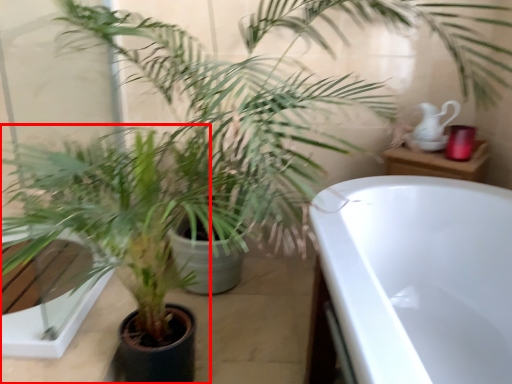
Question: From the image's perspective, where is houseplant (annotated by the red box) located in relation to tea pot in the image?

Choices:
 (A) below
 (B) above

Answer: (A)